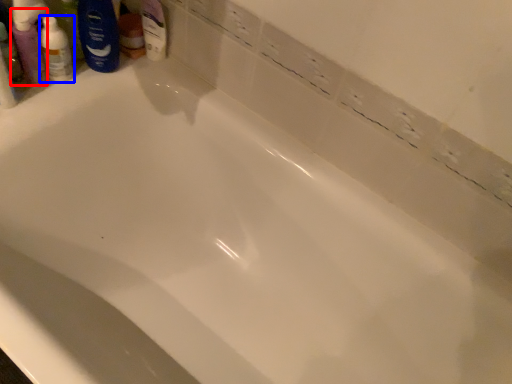
Question: Which point is closer to the camera, mouthwash (highlighted by a red box) or toiletry (highlighted by a blue box)?

Choices:
 (A) mouthwash
 (B) toiletry

Answer: (A)